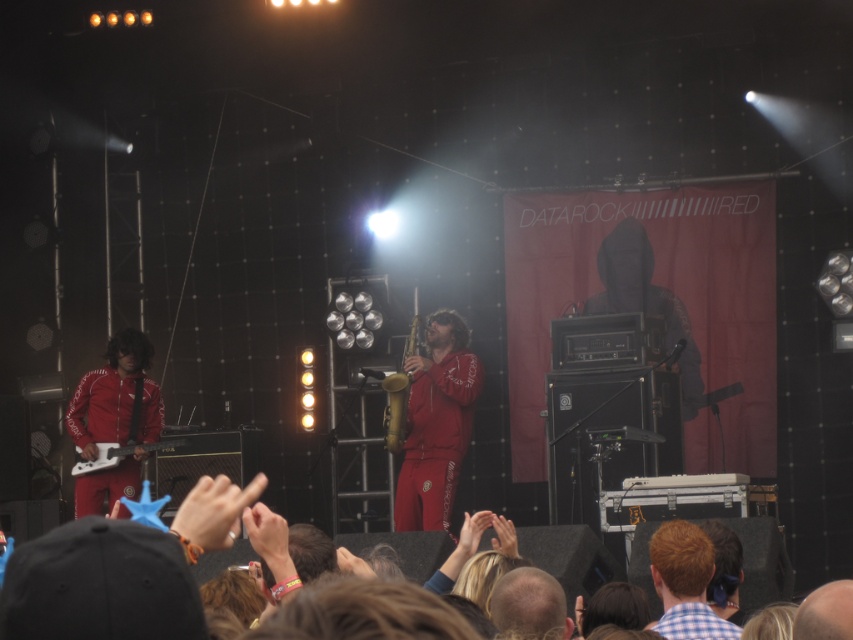
Is checkered fabric shirt at lower center bigger than gold brass saxophone at center?

Incorrect, checkered fabric shirt at lower center is not larger than gold brass saxophone at center.

Which is above, checkered fabric shirt at lower center or gold brass saxophone at center?

gold brass saxophone at center

Locate an element on the screen. The image size is (853, 640). checkered fabric shirt at lower center is located at coordinates (685, 582).

Does point (129, 484) lie behind point (515, 602)?

That is True.

What do you see at coordinates (115, 397) in the screenshot? This screenshot has width=853, height=640. I see `matte red suit at left` at bounding box center [115, 397].

Where is `matte red suit at left`? The width and height of the screenshot is (853, 640). matte red suit at left is located at coordinates (115, 397).

Can you confirm if matte red suit at left is wider than checkered fabric shirt at lower center?

Yes.

Can you confirm if matte red suit at left is positioned to the right of checkered fabric shirt at lower center?

No, matte red suit at left is not to the right of checkered fabric shirt at lower center.

Where is `matte red suit at left`? matte red suit at left is located at coordinates (115, 397).